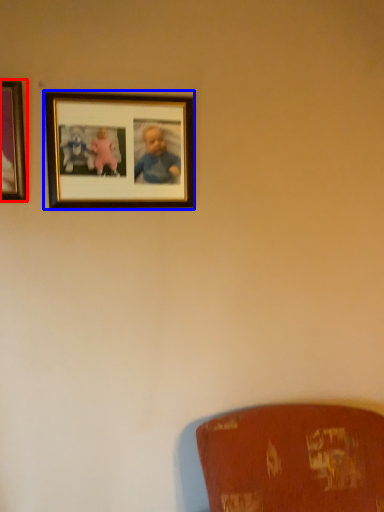
Question: Which object is further to the camera taking this photo, picture frame (highlighted by a red box) or picture frame (highlighted by a blue box)?

Choices:
 (A) picture frame
 (B) picture frame

Answer: (B)